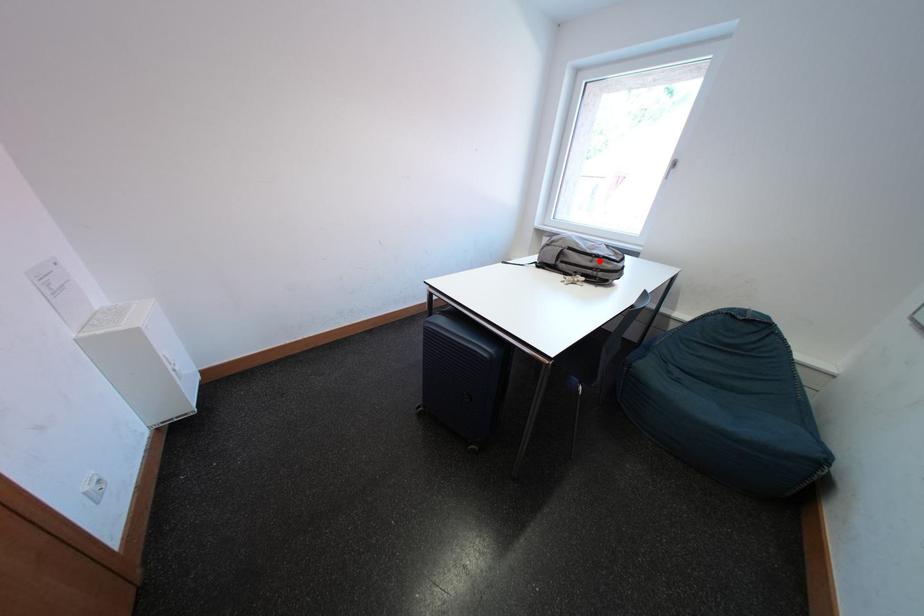
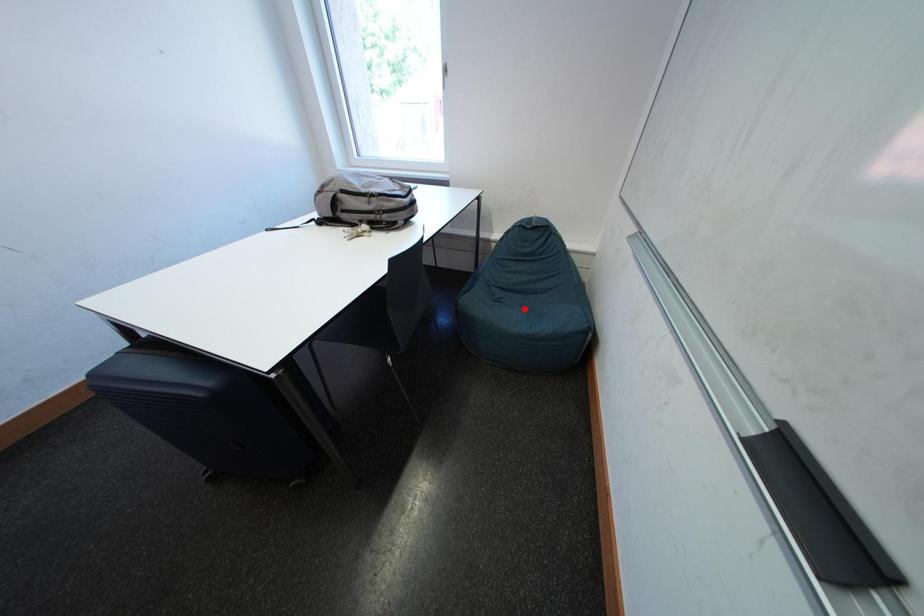
I am providing you with two images of the same scene from different viewpoints. A red point is marked on the first image and another point is marked on the second image. Does the point marked in image1 correspond to the same location as the one in image2?

No